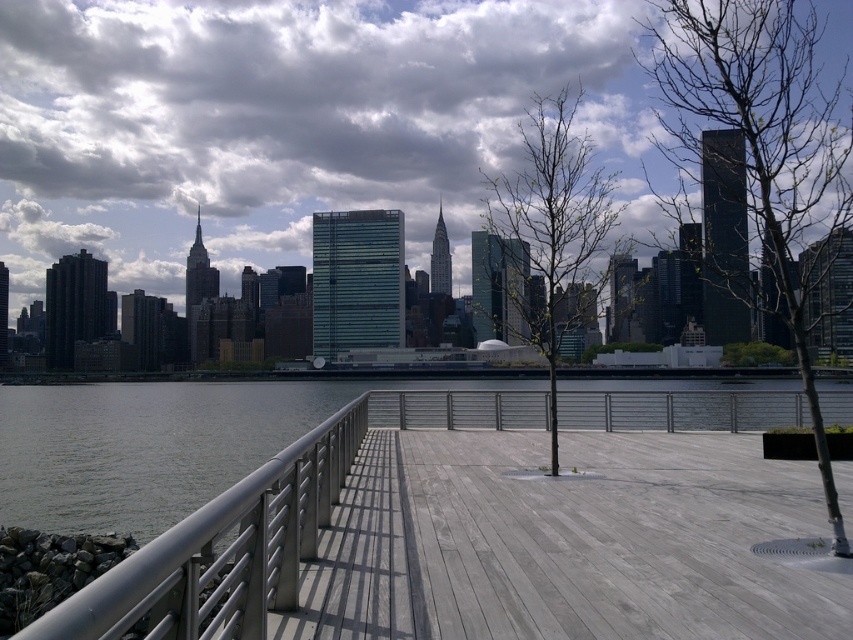
Is bare wood tree at center to the left of green leafy tree at center from the viewer's perspective?

Incorrect, bare wood tree at center is not on the left side of green leafy tree at center.

Is bare wood tree at center positioned in front of green leafy tree at center?

Yes, bare wood tree at center is in front of green leafy tree at center.

The height and width of the screenshot is (640, 853). Find the location of `bare wood tree at center`. bare wood tree at center is located at coordinates (759, 147).

Which of these two, smooth gray wood deck at center or bare wood tree at center, stands taller?

bare wood tree at center

Is smooth gray wood deck at center to the right of bare wood tree at center from the viewer's perspective?

No, smooth gray wood deck at center is not to the right of bare wood tree at center.

Find the location of a particular element. The image size is (853, 640). smooth gray wood deck at center is located at coordinates (260, 529).

Is smooth gray wood deck at center below green leafy tree at center?

Yes.

Can you confirm if smooth gray wood deck at center is thinner than green leafy tree at center?

Indeed, smooth gray wood deck at center has a lesser width compared to green leafy tree at center.

Between point (253, 476) and point (519, 125), which one is positioned in front?

Point (253, 476)

The width and height of the screenshot is (853, 640). Identify the location of smooth gray wood deck at center. point(260,529).